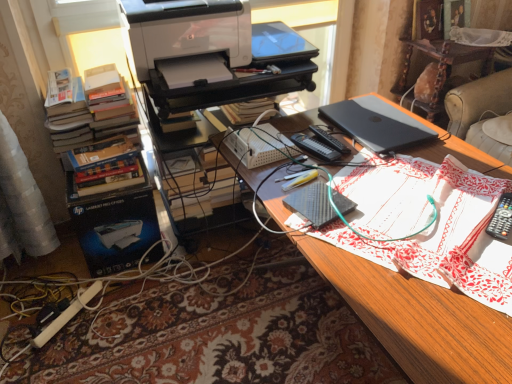
Question: From the image's perspective, is beige leather couch at upper right positioned above or below black matte laptop at upper right?

Choices:
 (A) above
 (B) below

Answer: (A)

Question: In the image, is beige leather couch at upper right positioned in front of or behind black matte laptop at upper right?

Choices:
 (A) front
 (B) behind

Answer: (B)

Question: Which is farther from the white matte printer at upper left?

Choices:
 (A) black textured notebook at center
 (B) black plastic remote control at right
 (C) beige leather couch at upper right
 (D) white plastic printer at upper center, acting as the second computer desk starting from the right
 (E) black plastic laptop at upper right, marked as the second computer desk in a left-to-right arrangement

Answer: (C)

Question: Considering the real-world distances, which object is farthest from the wooden desk at center?

Choices:
 (A) black textured notebook at center
 (B) white plastic printer at upper center, acting as the second computer desk starting from the right
 (C) hardcover books at left
 (D) black plastic remote control at right
 (E) black plastic laptop at upper right, marked as the second computer desk in a left-to-right arrangement

Answer: (E)